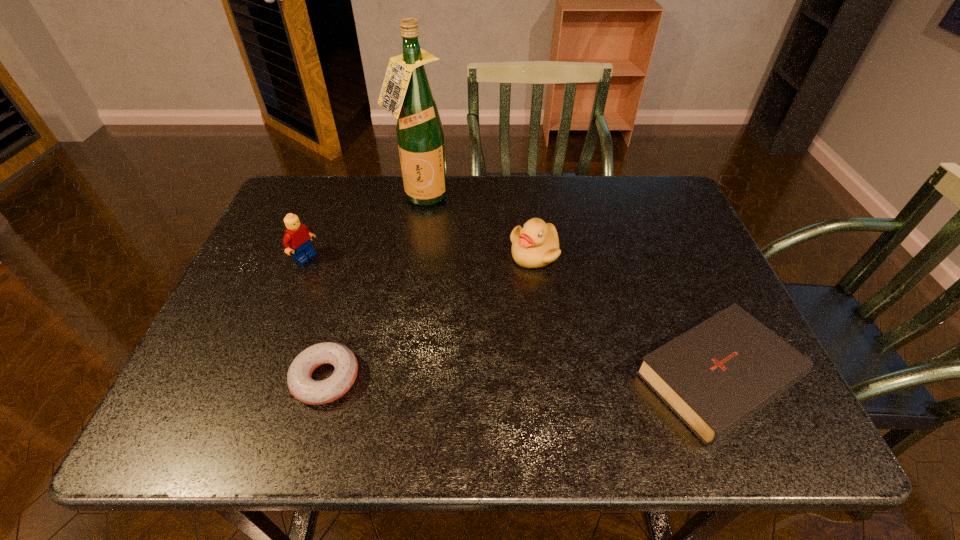
Locate an element on the screen. The width and height of the screenshot is (960, 540). free region located on the back of the second shortest object is located at coordinates (665, 233).

Identify the location of vacant space situated on the front-facing side of the fourth object from left to right. The height and width of the screenshot is (540, 960). (510, 343).

This screenshot has width=960, height=540. Find the location of `free space located 0.330m on the front-facing side of the fourth object from left to right`. free space located 0.330m on the front-facing side of the fourth object from left to right is located at coordinates (499, 382).

The height and width of the screenshot is (540, 960). In order to click on free space located on the front-facing side of the fourth object from left to right in this screenshot , I will do `click(519, 308)`.

The height and width of the screenshot is (540, 960). Find the location of `free space located 0.130m on the front-facing side of the Lego`. free space located 0.130m on the front-facing side of the Lego is located at coordinates (349, 284).

What are the coordinates of `free spot located 0.370m on the front-facing side of the Lego` in the screenshot? It's located at (427, 327).

The width and height of the screenshot is (960, 540). What are the coordinates of `free spot located 0.400m on the front-facing side of the Lego` in the screenshot? It's located at (438, 333).

Find the location of a particular element. This screenshot has height=540, width=960. free location located 0.290m on the front-facing side of the tallest object is located at coordinates (457, 284).

Identify the location of vacant space located on the front-facing side of the tallest object. The height and width of the screenshot is (540, 960). click(457, 284).

I want to click on free space located 0.210m on the front-facing side of the tallest object, so click(x=448, y=262).